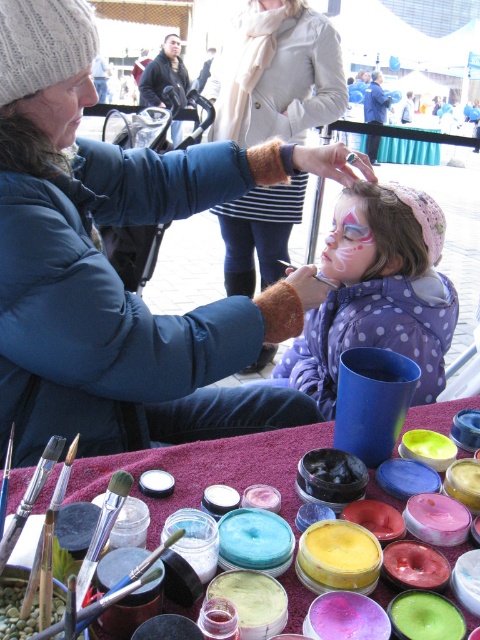
From the picture: You are a photographer trying to capture a closeup shot of the pastel dotted jacket at center and the matte black jacket at center. Which jacket should you focus on first to ensure it appears clearer in the photo?

The pastel dotted jacket at center is closer to the viewer than the matte black jacket at center, so you should focus on the pastel dotted jacket at center first to ensure it appears clearer in the photo.

You are standing at the center of the scene and want to move towards the two points labeled as point (3,163) and point (439,356). Which point would you reach first?

You would reach point (3,163) first because it is in front of point (439,356) from your perspective.

Please look at the point at coordinate (113, 269). What object is located at that point?

The point at coordinate (113, 269) is on the matte blue coat at center.